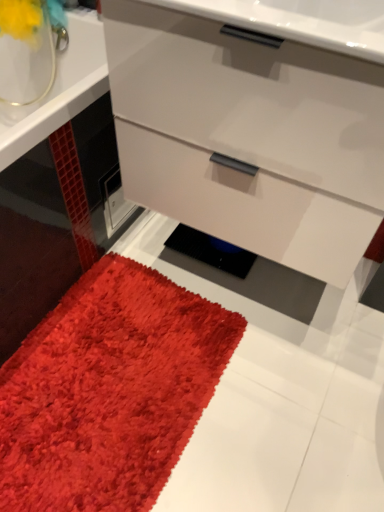
Locate an element on the screen. The height and width of the screenshot is (512, 384). matte yellow flower at upper left is located at coordinates (30, 18).

Between matte yellow flower at upper left and shaggy red carpet at lower left, which one has larger width?

shaggy red carpet at lower left.

From a real-world perspective, is matte yellow flower at upper left positioned under shaggy red carpet at lower left based on gravity?

No, from a real-world perspective, matte yellow flower at upper left is not under shaggy red carpet at lower left.

From the image's perspective, which object appears higher, matte yellow flower at upper left or shaggy red carpet at lower left?

From the image's view, matte yellow flower at upper left is above.

Could shaggy red carpet at lower left be considered to be inside matte yellow flower at upper left?

Definitely not — shaggy red carpet at lower left is not inside matte yellow flower at upper left.

From the image's perspective, who appears lower, matte white chest of drawers at center or matte yellow flower at upper left?

matte white chest of drawers at center is shown below in the image.

Is matte white chest of drawers at center far from matte yellow flower at upper left?

That's not correct — matte white chest of drawers at center is a little close to matte yellow flower at upper left.

Between matte white chest of drawers at center and matte yellow flower at upper left, which one has more height?

With more height is matte white chest of drawers at center.

Which object is positioned more to the right, matte white chest of drawers at center or matte yellow flower at upper left?

matte white chest of drawers at center is more to the right.

Is matte white chest of drawers at center situated inside shaggy red carpet at lower left or outside?

matte white chest of drawers at center cannot be found inside shaggy red carpet at lower left.

Considering the sizes of objects matte white chest of drawers at center and shaggy red carpet at lower left in the image provided, who is bigger, matte white chest of drawers at center or shaggy red carpet at lower left?

Bigger between the two is matte white chest of drawers at center.

Between matte white chest of drawers at center and shaggy red carpet at lower left, which one appears on the right side from the viewer's perspective?

From the viewer's perspective, matte white chest of drawers at center appears more on the right side.

Is matte white chest of drawers at center looking in the opposite direction of shaggy red carpet at lower left?

No.

There is a matte white chest of drawers at center. In order to click on flower above it (from a real-world perspective) in this screenshot , I will do (x=30, y=18).

Is matte yellow flower at upper left in front of or behind matte white chest of drawers at center in the image?

matte yellow flower at upper left is behind matte white chest of drawers at center.

In the scene shown: Who is smaller, matte yellow flower at upper left or matte white chest of drawers at center?

Smaller between the two is matte yellow flower at upper left.

Can you see shaggy red carpet at lower left touching matte yellow flower at upper left?

No, shaggy red carpet at lower left is not touching matte yellow flower at upper left.

Does point (2, 420) appear closer or farther from the camera than point (16, 3)?

Clearly, point (2, 420) is closer to the camera than point (16, 3).

From their relative heights in the image, would you say shaggy red carpet at lower left is taller or shorter than matte yellow flower at upper left?

Clearly, shaggy red carpet at lower left is shorter compared to matte yellow flower at upper left.

Considering the sizes of shaggy red carpet at lower left and matte white chest of drawers at center in the image, is shaggy red carpet at lower left taller or shorter than matte white chest of drawers at center?

shaggy red carpet at lower left is shorter than matte white chest of drawers at center.

Is matte white chest of drawers at center surrounded by shaggy red carpet at lower left?

Definitely not — matte white chest of drawers at center is not inside shaggy red carpet at lower left.

Consider the image. Is the surface of shaggy red carpet at lower left in direct contact with matte white chest of drawers at center?

No.

Is shaggy red carpet at lower left looking in the opposite direction of matte white chest of drawers at center?

No, matte white chest of drawers at center is not at the back of shaggy red carpet at lower left.

At what (x,y) coordinates should I click in order to perform the action: click on mat on the right of the matte yellow flower at upper left. Please return your answer as a coordinate pair (x, y). The image size is (384, 512). Looking at the image, I should click on (109, 391).

This screenshot has height=512, width=384. In order to click on the chest of drawers in front of the matte yellow flower at upper left in this screenshot , I will do `click(248, 137)`.

Based on their spatial positions, is matte yellow flower at upper left or matte white chest of drawers at center further from shaggy red carpet at lower left?

matte yellow flower at upper left is positioned further to the anchor shaggy red carpet at lower left.

Estimate the real-world distances between objects in this image. Which object is further from matte white chest of drawers at center, matte yellow flower at upper left or shaggy red carpet at lower left?

matte yellow flower at upper left is positioned further to the anchor matte white chest of drawers at center.

Looking at the image, which one is located further to matte yellow flower at upper left, shaggy red carpet at lower left or matte white chest of drawers at center?

Among the two, shaggy red carpet at lower left is located further to matte yellow flower at upper left.

Based on their spatial positions, is shaggy red carpet at lower left or matte yellow flower at upper left closer to matte white chest of drawers at center?

Based on the image, shaggy red carpet at lower left appears to be nearer to matte white chest of drawers at center.

When comparing their distances from shaggy red carpet at lower left, does matte white chest of drawers at center or matte yellow flower at upper left seem closer?

matte white chest of drawers at center.

When comparing their distances from matte yellow flower at upper left, does matte white chest of drawers at center or shaggy red carpet at lower left seem further?

The object further to matte yellow flower at upper left is shaggy red carpet at lower left.

This screenshot has height=512, width=384. I want to click on chest of drawers between matte yellow flower at upper left and shaggy red carpet at lower left in the vertical direction, so click(248, 137).